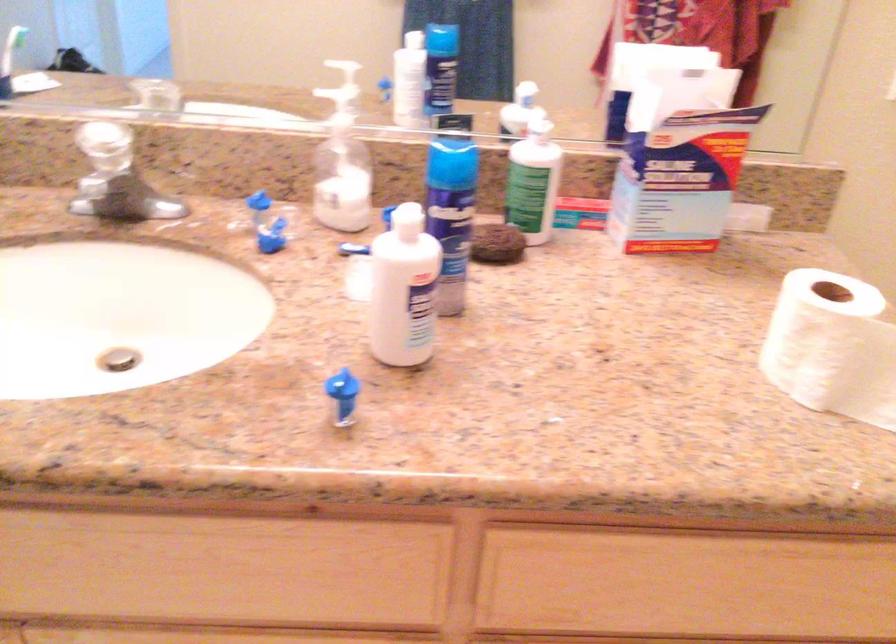
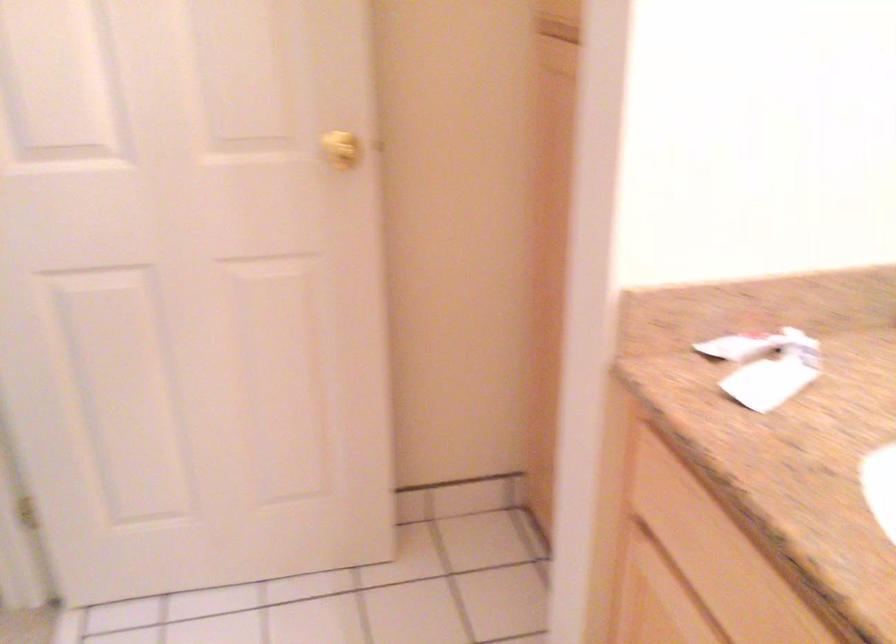
Question: Based on the continuous images, in which direction is the camera rotating? Reply with the corresponding letter.

Choices:
 (A) Left
 (B) Right
 (C) Up
 (D) Down

Answer: (A)